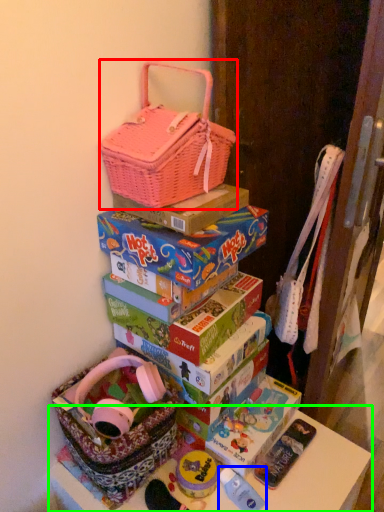
Question: Based on their relative distances, which object is nearer to handbag (highlighted by a red box)? Choose from toy (highlighted by a blue box) and table (highlighted by a green box).

Choices:
 (A) toy
 (B) table

Answer: (B)